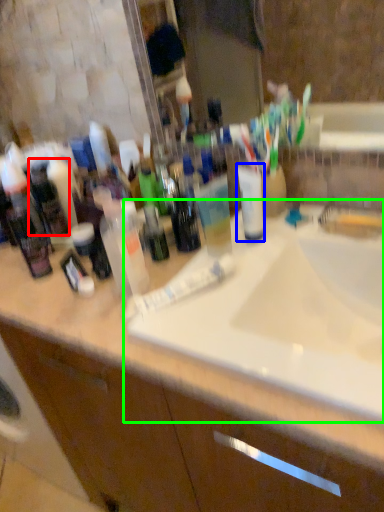
Question: Which object is positioned closest to toiletry (highlighted by a red box)? Select from mouthwash (highlighted by a blue box) and sink (highlighted by a green box).

Choices:
 (A) mouthwash
 (B) sink

Answer: (A)